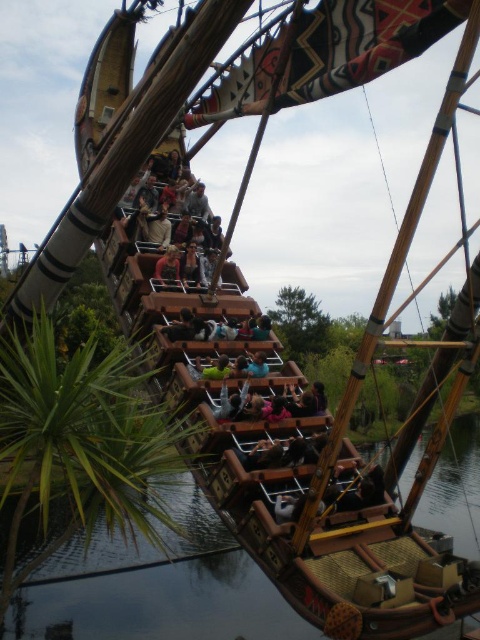
Does point (73, 628) lie in front of point (155, 268)?

Yes.

This screenshot has width=480, height=640. I want to click on transparent water at lower center, so click(151, 598).

Between wooden plank at center and light brown wood at center, which one appears on the right side from the viewer's perspective?

From the viewer's perspective, light brown wood at center appears more on the right side.

Locate an element on the screen. wooden plank at center is located at coordinates pos(168,205).

Who is more distant from viewer, (151, 237) or (155, 272)?

Positioned behind is point (151, 237).

You are a GUI agent. You are given a task and a screenshot of the screen. Output one action in this format:
    pyautogui.click(x=<x>, y=<y>)
    Task: Click on the wooden plank at center
    
    Given the screenshot: What is the action you would take?
    pyautogui.click(x=168, y=205)

What do you see at coordinates (151, 598) in the screenshot?
I see `transparent water at lower center` at bounding box center [151, 598].

The image size is (480, 640). I want to click on transparent water at lower center, so click(x=151, y=598).